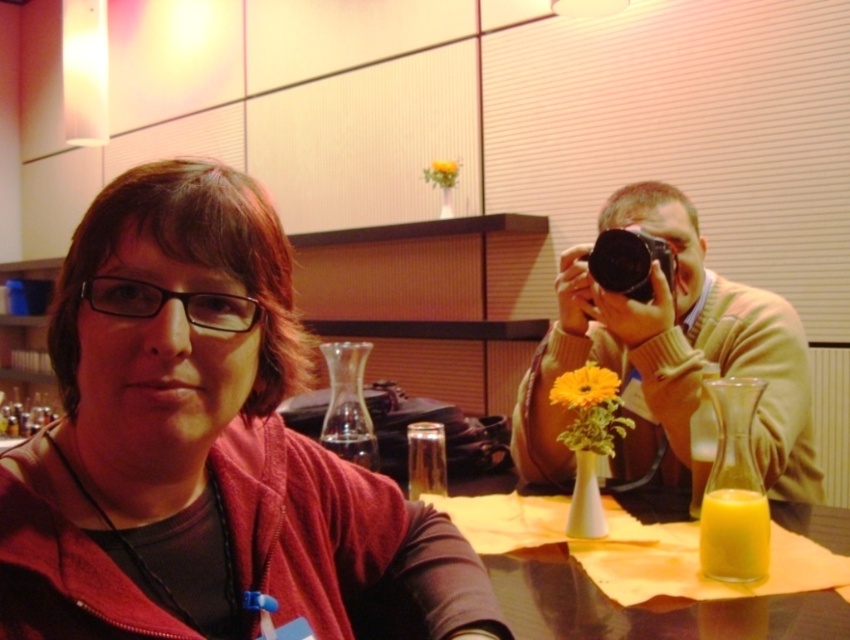
Question: Does translucent glass cup at lower right have a larger size compared to black plastic glasses at center?

Choices:
 (A) no
 (B) yes

Answer: (B)

Question: Which point is closer to the camera?

Choices:
 (A) orange matte flower at center
 (B) matte beige sweater at right
 (C) black plastic glasses at center
 (D) black plastic camera at center

Answer: (C)

Question: Is matte beige sweater at right wider than orange matte flower at center?

Choices:
 (A) no
 (B) yes

Answer: (B)

Question: Based on their relative distances, which object is farther from the matte beige sweater at right?

Choices:
 (A) yellow glass at center
 (B) black plastic camera at center
 (C) orange matte flower at center
 (D) yellow matte flower at upper center

Answer: (D)

Question: Is black plastic glasses at center positioned before black plastic camera at center?

Choices:
 (A) no
 (B) yes

Answer: (B)

Question: Which point appears farthest from the camera in this image?

Choices:
 (A) (707, 301)
 (B) (588, 388)
 (C) (726, 492)

Answer: (A)